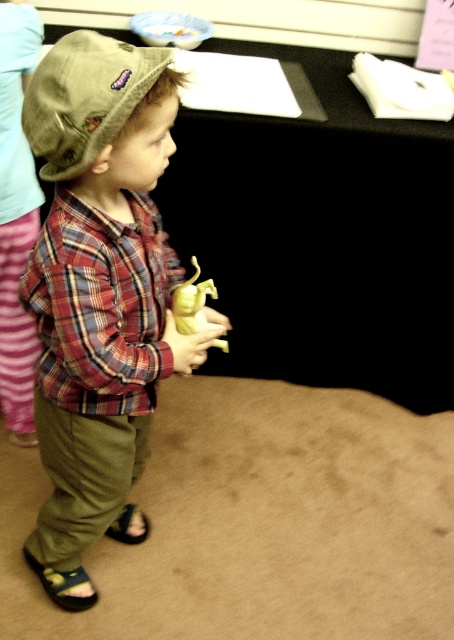
You are a photographer setting up for a photo shoot. You need to position a light source so it illuminates the green fabric pants at lower left without affecting other areas. Given that the pants are 1.40 meters away, what is the minimum distance the light should be placed from the pants to ensure it only lights them?

The light source should be placed at least 1.40 meters away from the green fabric pants at lower left to ensure it only illuminates them without affecting other areas.

You are a fashion designer trying to decide whether to use the plaid fabric shirt at center as a base for a new design. Since the matte yellow toy at center is also in the image, could the toy be used as a scale reference to determine if the shirt is large enough for a child?

The plaid fabric shirt at center is bigger than the matte yellow toy at center, so the shirt is large enough for a child when compared to the toy.